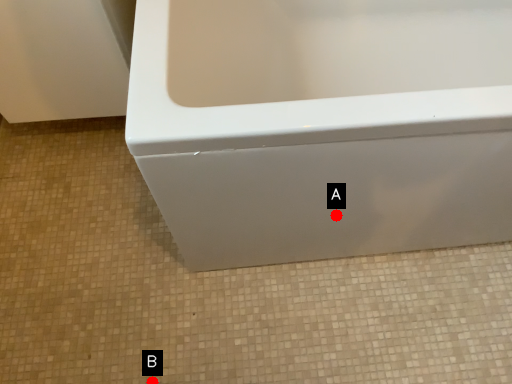
Question: Two points are circled on the image, labeled by A and B beside each circle. Which point is closer to the camera taking this photo?

Choices:
 (A) A is closer
 (B) B is closer

Answer: (A)